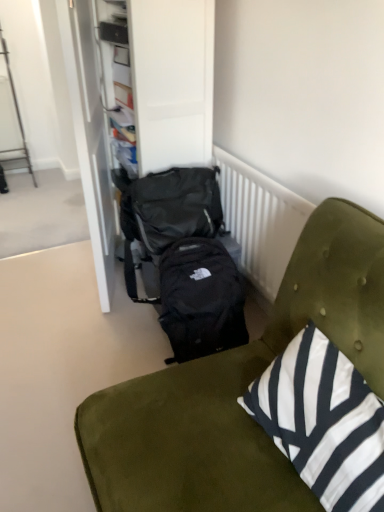
Locate an element on the screen. The width and height of the screenshot is (384, 512). white striped fabric pillow at lower right is located at coordinates (323, 421).

Image resolution: width=384 pixels, height=512 pixels. What do you see at coordinates (172, 81) in the screenshot?
I see `black fabric dresser at center` at bounding box center [172, 81].

Describe the element at coordinates (167, 212) in the screenshot. I see `black fabric backpack at center, the second backpack ordered from the bottom` at that location.

Image resolution: width=384 pixels, height=512 pixels. I want to click on black fabric backpack at center, positioned as the first backpack in top-to-bottom order, so click(167, 212).

Find the location of a particular element. This screenshot has height=512, width=384. white textured radiator at center is located at coordinates (260, 220).

At what (x,y) coordinates should I click in order to perform the action: click on white striped fabric pillow at lower right. Please return your answer as a coordinate pair (x, y). This screenshot has width=384, height=512. Looking at the image, I should click on (323, 421).

From a real-world perspective, which object stands above the other?

black fabric backpack at center, the second backpack ordered from the bottom, from a real-world perspective.

Considering the relative positions of black matte backpack at center, which appears as the first backpack when ordered from the bottom, and black fabric backpack at center, the second backpack ordered from the bottom, in the image provided, is black matte backpack at center, which appears as the first backpack when ordered from the bottom, to the left of black fabric backpack at center, the second backpack ordered from the bottom, from the viewer's perspective?

No.

Is black matte backpack at center, which appears as the first backpack when ordered from the bottom, turned away from black fabric backpack at center, the second backpack ordered from the bottom?

Absolutely, black matte backpack at center, which appears as the first backpack when ordered from the bottom, is directed away from black fabric backpack at center, the second backpack ordered from the bottom.

Is white textured radiator at center touching black fabric backpack at center, positioned as the first backpack in top-to-bottom order?

There is a gap between white textured radiator at center and black fabric backpack at center, positioned as the first backpack in top-to-bottom order.

Considering the relative sizes of white textured radiator at center and black fabric backpack at center, positioned as the first backpack in top-to-bottom order, in the image provided, is white textured radiator at center smaller than black fabric backpack at center, positioned as the first backpack in top-to-bottom order,?

Yes.

Which is nearer, (255, 173) or (196, 192)?

Point (255, 173) is positioned closer to the camera compared to point (196, 192).

Can you confirm if white striped fabric pillow at lower right is thinner than white textured radiator at center?

No, white striped fabric pillow at lower right is not thinner than white textured radiator at center.

Measure the distance between white striped fabric pillow at lower right and white textured radiator at center.

white striped fabric pillow at lower right and white textured radiator at center are 76.90 centimeters apart.

Which object is closer to the camera taking this photo, white striped fabric pillow at lower right or white textured radiator at center?

white striped fabric pillow at lower right is in front.

Does black matte backpack at center, which appears as the first backpack when ordered from the bottom, have a larger size compared to white striped fabric pillow at lower right?

No, black matte backpack at center, which appears as the first backpack when ordered from the bottom, is not bigger than white striped fabric pillow at lower right.

Who is shorter, black matte backpack at center, which appears as the first backpack when ordered from the bottom, or white striped fabric pillow at lower right?

white striped fabric pillow at lower right is shorter.

From the image's perspective, is black matte backpack at center, which is counted as the second backpack, starting from the top, above or below white striped fabric pillow at lower right?

black matte backpack at center, which is counted as the second backpack, starting from the top, is situated higher than white striped fabric pillow at lower right in the image.

Which is more distant, (241, 310) or (298, 391)?

The point (241, 310) is farther from the camera.

Which object is positioned more to the left, black fabric backpack at center or black fabric dresser at center?

Positioned to the left is black fabric dresser at center.

Locate an element on the screen. This screenshot has width=384, height=512. furniture that is below the black fabric dresser at center (from the image's perspective) is located at coordinates (238, 388).

How different are the orientations of black fabric backpack at center and black fabric dresser at center in degrees?

The angle between the facing direction of black fabric backpack at center and the facing direction of black fabric dresser at center is 0.5 degrees.

From a real-world perspective, is black fabric backpack at center physically located above or below black fabric dresser at center?

From a real-world perspective, black fabric backpack at center is physically below black fabric dresser at center.

Would you say black fabric dresser at center contains black fabric backpack at center?

No, black fabric dresser at center does not contain black fabric backpack at center.

Looking at this image, is black fabric dresser at center not close to black fabric backpack at center?

Yes, black fabric dresser at center and black fabric backpack at center are located far from each other.

Does point (93, 33) come behind point (106, 452)?

Yes.

From the image's perspective, is black fabric dresser at center on black fabric backpack at center?

Correct, black fabric dresser at center appears higher than black fabric backpack at center in the image.

Is point (122, 387) positioned in front of point (303, 379)?

No, it is not.

Does black fabric backpack at center have a lesser width compared to white striped fabric pillow at lower right?

Incorrect, the width of black fabric backpack at center is not less than that of white striped fabric pillow at lower right.

Is black fabric backpack at center not within white striped fabric pillow at lower right?

Indeed, black fabric backpack at center is completely outside white striped fabric pillow at lower right.

The width and height of the screenshot is (384, 512). Identify the location of pillow lying behind the black fabric backpack at center. (323, 421).

Locate an element on the screen. The height and width of the screenshot is (512, 384). backpack below the black fabric backpack at center, positioned as the first backpack in top-to-bottom order (from the image's perspective) is located at coordinates (201, 298).

Identify the location of the 2nd backpack to the left of the white textured radiator at center, counting from the anchor's position. (167, 212).

Estimate the real-world distances between objects in this image. Which object is closer to white textured radiator at center, black fabric dresser at center or white striped fabric pillow at lower right?

black fabric dresser at center is positioned closer to the anchor white textured radiator at center.

Based on their spatial positions, is black fabric dresser at center or black fabric backpack at center further from white striped fabric pillow at lower right?

black fabric dresser at center is further to white striped fabric pillow at lower right.

Based on their spatial positions, is white textured radiator at center or black matte backpack at center, which is counted as the second backpack, starting from the top, further from black fabric backpack at center, the second backpack ordered from the bottom?

white textured radiator at center is positioned further to the anchor black fabric backpack at center, the second backpack ordered from the bottom.

Estimate the real-world distances between objects in this image. Which object is further from black matte backpack at center, which appears as the first backpack when ordered from the bottom, white textured radiator at center or black fabric backpack at center?

black fabric backpack at center is positioned further to the anchor black matte backpack at center, which appears as the first backpack when ordered from the bottom.

Estimate the real-world distances between objects in this image. Which object is further from white striped fabric pillow at lower right, black matte backpack at center, which appears as the first backpack when ordered from the bottom, or black fabric backpack at center?

Among the two, black matte backpack at center, which appears as the first backpack when ordered from the bottom, is located further to white striped fabric pillow at lower right.

Which object lies nearer to the anchor point black fabric backpack at center, positioned as the first backpack in top-to-bottom order, black matte backpack at center, which appears as the first backpack when ordered from the bottom, or white textured radiator at center?

The object closer to black fabric backpack at center, positioned as the first backpack in top-to-bottom order, is black matte backpack at center, which appears as the first backpack when ordered from the bottom.

Based on their spatial positions, is black matte backpack at center, which is counted as the second backpack, starting from the top, or black fabric backpack at center, the second backpack ordered from the bottom, closer to white textured radiator at center?

black fabric backpack at center, the second backpack ordered from the bottom, is positioned closer to the anchor white textured radiator at center.

Which object lies further to the anchor point white textured radiator at center, black fabric dresser at center or black fabric backpack at center, positioned as the first backpack in top-to-bottom order?

Among the two, black fabric dresser at center is located further to white textured radiator at center.

You are a GUI agent. You are given a task and a screenshot of the screen. Output one action in this format:
    pyautogui.click(x=<x>, y=<y>)
    Task: Click on the backpack that lies between black fabric dresser at center and white textured radiator at center from top to bottom
    The image size is (384, 512).
    Given the screenshot: What is the action you would take?
    pyautogui.click(x=167, y=212)

You are a GUI agent. You are given a task and a screenshot of the screen. Output one action in this format:
    pyautogui.click(x=<x>, y=<y>)
    Task: Click on the backpack between white striped fabric pillow at lower right and black fabric backpack at center, the second backpack ordered from the bottom, from front to back
    
    Given the screenshot: What is the action you would take?
    pyautogui.click(x=201, y=298)

Image resolution: width=384 pixels, height=512 pixels. I want to click on pillow located between black fabric backpack at center and black matte backpack at center, which appears as the first backpack when ordered from the bottom, in the depth direction, so click(323, 421).

Locate an element on the screen. dresser between white striped fabric pillow at lower right and black fabric backpack at center, the second backpack ordered from the bottom, in the front-back direction is located at coordinates (172, 81).